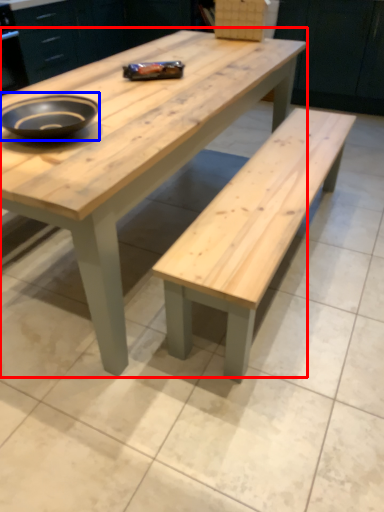
Question: Which point is further to the camera, coffee table (highlighted by a red box) or bowl (highlighted by a blue box)?

Choices:
 (A) coffee table
 (B) bowl

Answer: (B)